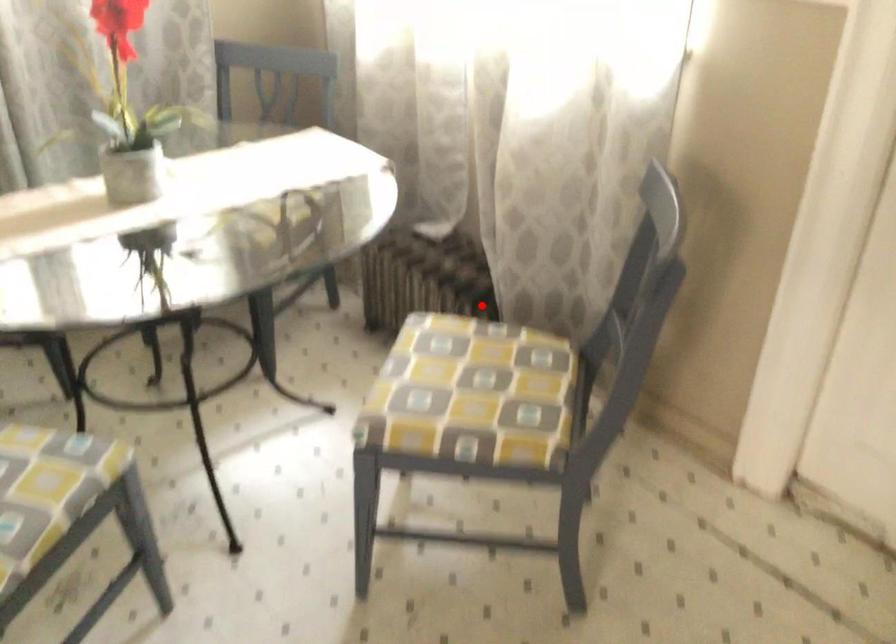
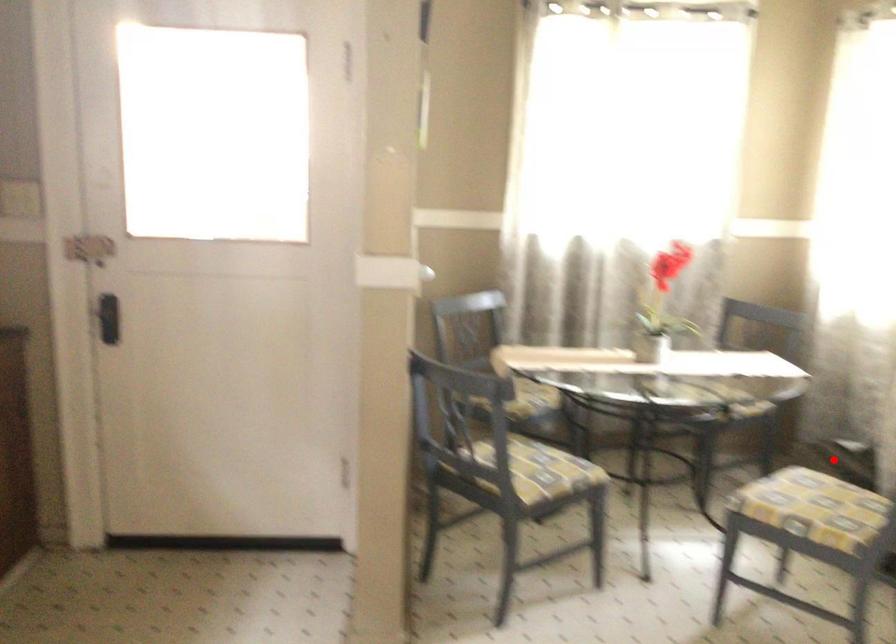
I am providing you with two images of the same scene from different viewpoints. A red point is marked on the first image and another point is marked on the second image. Do the highlighted points in image1 and image2 indicate the same real-world spot?

Yes